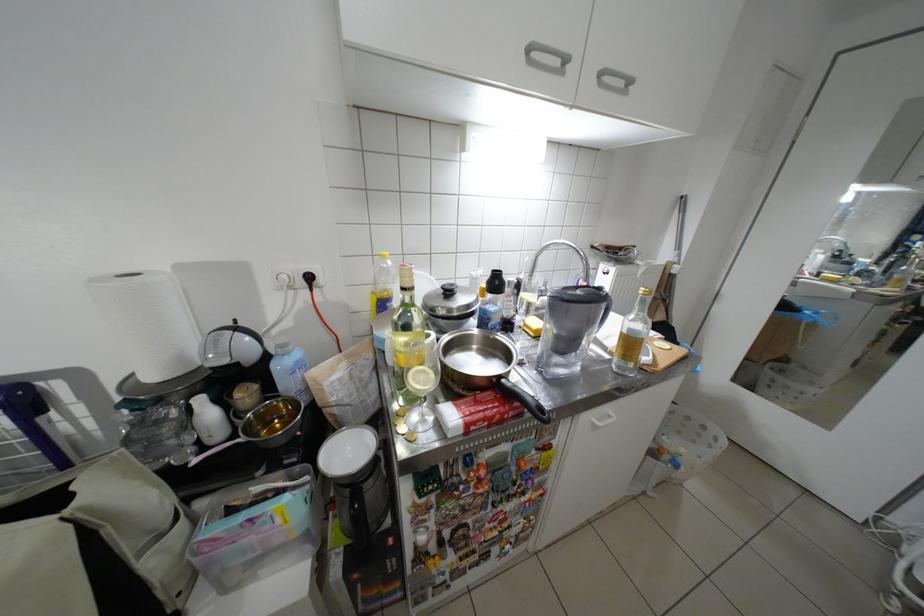
Image resolution: width=924 pixels, height=616 pixels. What do you see at coordinates (604, 312) in the screenshot? I see `a kettle handle` at bounding box center [604, 312].